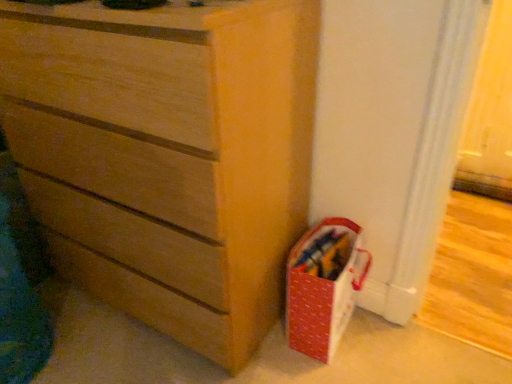
Question: From their relative heights in the image, would you say red fabric basket at lower right is taller or shorter than matte wood chest of drawers at center?

Choices:
 (A) short
 (B) tall

Answer: (A)

Question: Considering the positions of point (297, 344) and point (301, 89), is point (297, 344) closer or farther from the camera than point (301, 89)?

Choices:
 (A) farther
 (B) closer

Answer: (A)

Question: Looking at their shapes, would you say red fabric basket at lower right is wider or thinner than matte wood chest of drawers at center?

Choices:
 (A) thin
 (B) wide

Answer: (A)

Question: From the image's perspective, is matte wood chest of drawers at center positioned above or below red fabric basket at lower right?

Choices:
 (A) above
 (B) below

Answer: (A)

Question: From a real-world perspective, relative to red fabric basket at lower right, is matte wood chest of drawers at center vertically above or below?

Choices:
 (A) above
 (B) below

Answer: (A)

Question: Do you think matte wood chest of drawers at center is within red fabric basket at lower right, or outside of it?

Choices:
 (A) inside
 (B) outside

Answer: (B)

Question: Is matte wood chest of drawers at center wider or thinner than red fabric basket at lower right?

Choices:
 (A) wide
 (B) thin

Answer: (A)